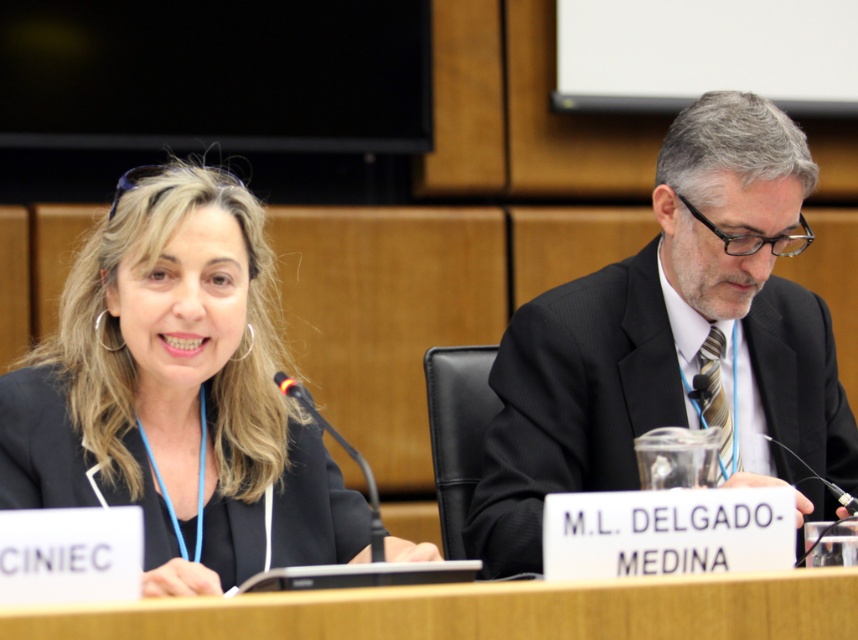
Question: Among these points, which one is nearest to the camera?

Choices:
 (A) (118, 342)
 (B) (323, 513)

Answer: (A)

Question: Is the position of matte black blazer at center more distant than that of black suit at right?

Choices:
 (A) yes
 (B) no

Answer: (B)

Question: Can you confirm if black suit at right is positioned to the right of black matte blazer at left?

Choices:
 (A) yes
 (B) no

Answer: (A)

Question: Is black suit at right to the right of wooden table at center from the viewer's perspective?

Choices:
 (A) no
 (B) yes

Answer: (B)

Question: Which object is closer to the camera taking this photo?

Choices:
 (A) black matte blazer at left
 (B) black suit at right

Answer: (A)

Question: Among these points, which one is farthest from the camera?

Choices:
 (A) (168, 604)
 (B) (299, 492)
 (C) (593, 308)
 (D) (5, 467)

Answer: (C)